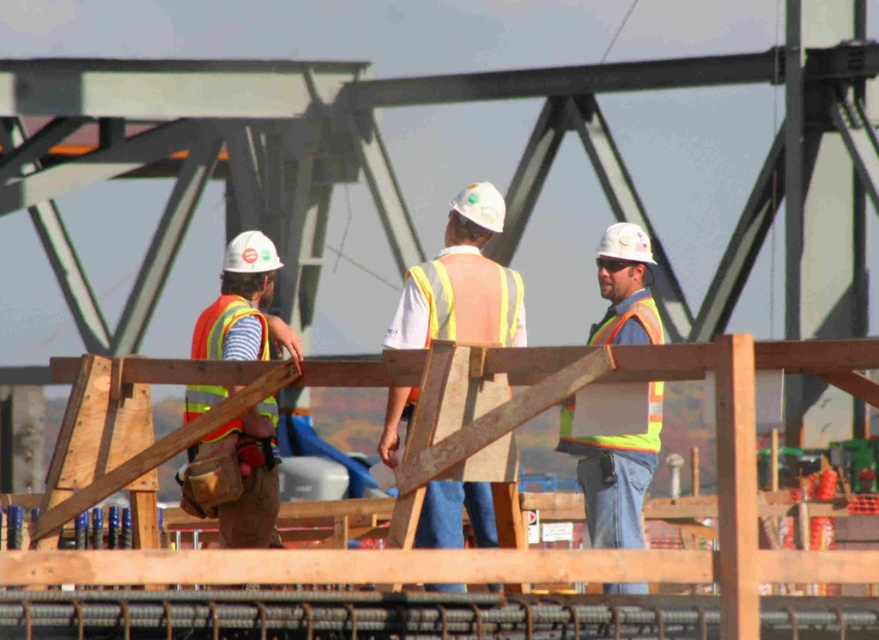
You are a safety inspector at the construction site. You notice two workers wearing reflective orange vests. One is the reflective orange vest at center and the other is the reflective orange vest at left. Which worker should you check first for proper vest compliance?

The reflective orange vest at center should be checked first because it is larger in size than the reflective orange vest at left, which may indicate noncompliance with safety standards.

You are a safety inspector observing the construction site. You notice two workers wearing reflective orange vests. The one at the center and the one at the left. From your vantage point, which worker is closer to you, the reflective orange vest at center or the reflective orange vest at left?

The reflective orange vest at center is closer to you because it is in front of the reflective orange vest at left.